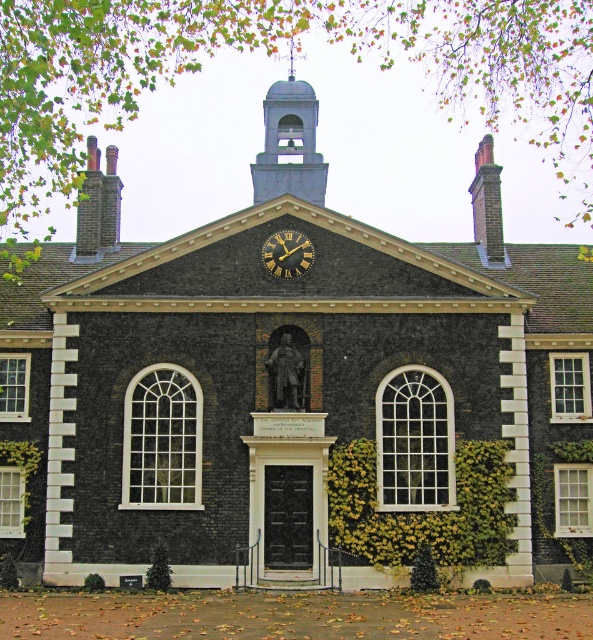
Between point (276, 193) and point (572, 400), which one is positioned behind?

Positioned behind is point (276, 193).

Can you confirm if metallic gray bell tower at upper center is thinner than clear glass window at right?

In fact, metallic gray bell tower at upper center might be wider than clear glass window at right.

Locate an element on the screen. metallic gray bell tower at upper center is located at coordinates (289, 144).

Who is more forward, (586, 355) or (14, 493)?

Point (14, 493) is more forward.

Does clear glass window at right appear over white textured window at lower left?

Correct, clear glass window at right is located above white textured window at lower left.

Does point (570, 412) lie behind point (20, 522)?

Yes, point (570, 412) is behind point (20, 522).

Where is `clear glass window at right`? clear glass window at right is located at coordinates (569, 387).

Who is positioned more to the left, clear glass window at right or gold-toned metal clock at center?

gold-toned metal clock at center

Can you confirm if clear glass window at right is wider than gold-toned metal clock at center?

Incorrect, clear glass window at right's width does not surpass gold-toned metal clock at center's.

Who is more forward, (x=570, y=413) or (x=301, y=234)?

Point (x=301, y=234) is more forward.

Image resolution: width=593 pixels, height=640 pixels. In order to click on clear glass window at right in this screenshot , I will do pos(569,387).